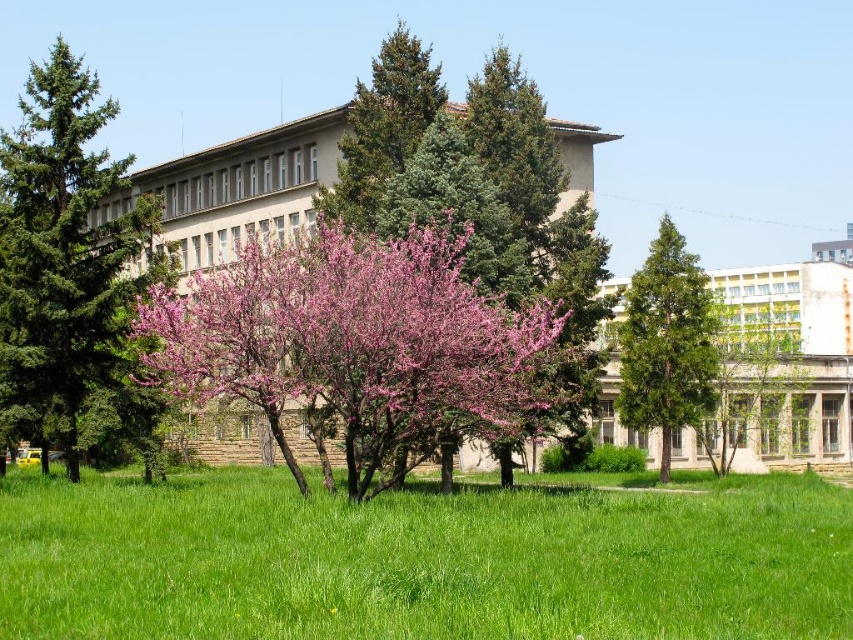
Can you confirm if green matte tree at center is bigger than green textured tree at upper center?

No, green matte tree at center is not bigger than green textured tree at upper center.

Based on the photo, is green matte tree at center smaller than green textured tree at upper center?

Yes, green matte tree at center is smaller than green textured tree at upper center.

This screenshot has height=640, width=853. Describe the element at coordinates (666, 342) in the screenshot. I see `green matte tree at center` at that location.

Locate an element on the screen. green matte tree at center is located at coordinates (666, 342).

Is pink bloom at center closer to the viewer compared to green matte tree at center?

Yes, it is in front of green matte tree at center.

Can you confirm if pink bloom at center is smaller than green matte tree at center?

Incorrect, pink bloom at center is not smaller in size than green matte tree at center.

The height and width of the screenshot is (640, 853). Identify the location of pink bloom at center. (355, 333).

Is pink bloom at center to the right of green textured tree at upper center from the viewer's perspective?

No, pink bloom at center is not to the right of green textured tree at upper center.

Can you confirm if pink bloom at center is positioned to the left of green textured tree at upper center?

Yes, pink bloom at center is to the left of green textured tree at upper center.

Which is behind, point (192, 368) or point (386, 129)?

The point (386, 129) is more distant.

Find the location of a particular element. The image size is (853, 640). pink bloom at center is located at coordinates (355, 333).